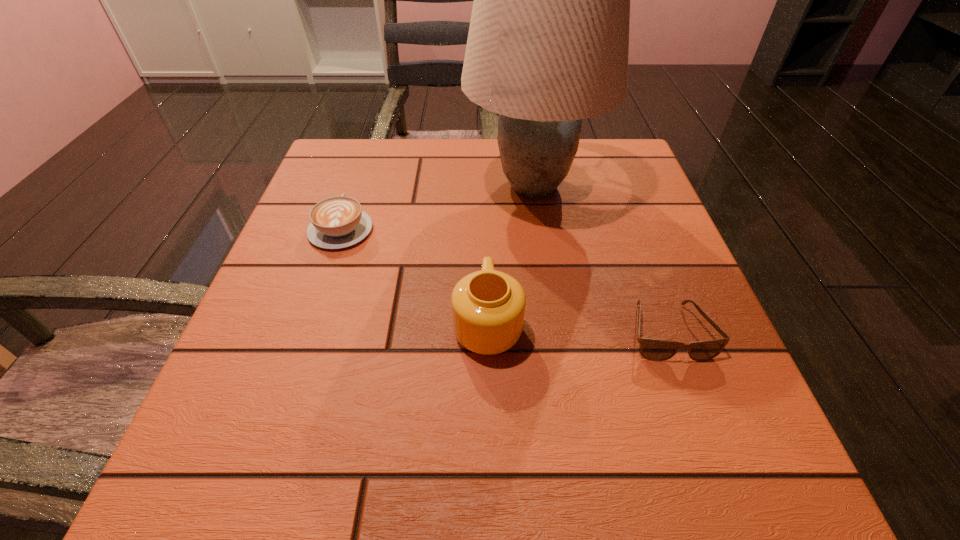
You are a GUI agent. You are given a task and a screenshot of the screen. Output one action in this format:
    pyautogui.click(x=<x>, y=<y>)
    Task: Click on the lampshade
    
    Given the screenshot: What is the action you would take?
    pyautogui.click(x=548, y=44)

Locate an element on the screen. the third shortest object is located at coordinates [488, 306].

In order to click on cappuccino in this screenshot , I will do coord(337,222).

Find the location of a particular element. This screenshot has height=540, width=960. sunglasses is located at coordinates (652, 349).

Locate an element on the screen. vacant space located 0.050m on the right of the lampshade is located at coordinates (625, 186).

Find the location of `vacant space located on the handle side of the third shortest object`. vacant space located on the handle side of the third shortest object is located at coordinates click(x=486, y=193).

Find the location of a particular element. blank space located 0.050m on the handle side of the third shortest object is located at coordinates (487, 269).

Identify the location of vacant position located 0.320m on the handle side of the third shortest object. Image resolution: width=960 pixels, height=540 pixels. (486, 182).

Where is `free spot located 0.100m on the side of the leftmost object with the handle`? This screenshot has width=960, height=540. free spot located 0.100m on the side of the leftmost object with the handle is located at coordinates (357, 181).

This screenshot has height=540, width=960. I want to click on blank area located 0.240m on the side of the leftmost object with the handle, so click(x=369, y=148).